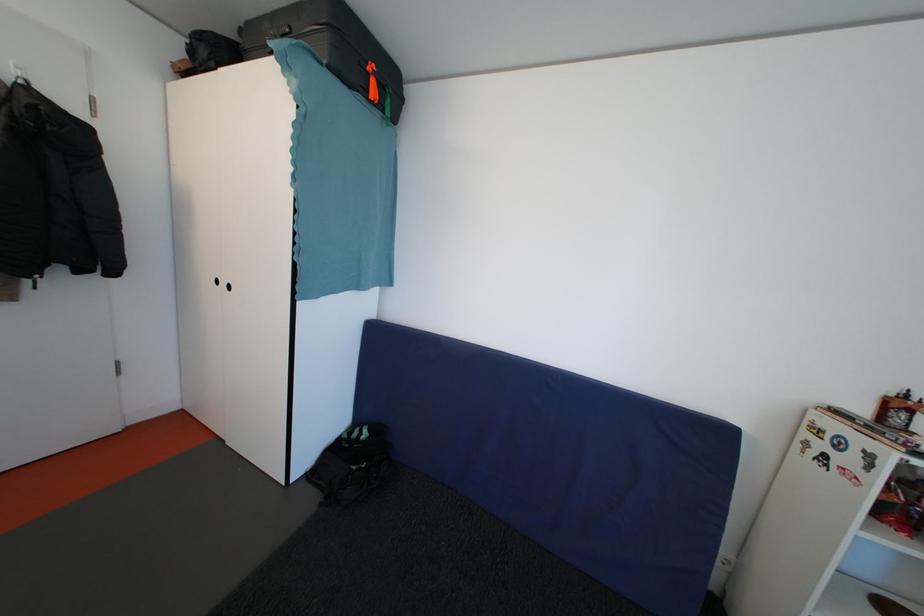
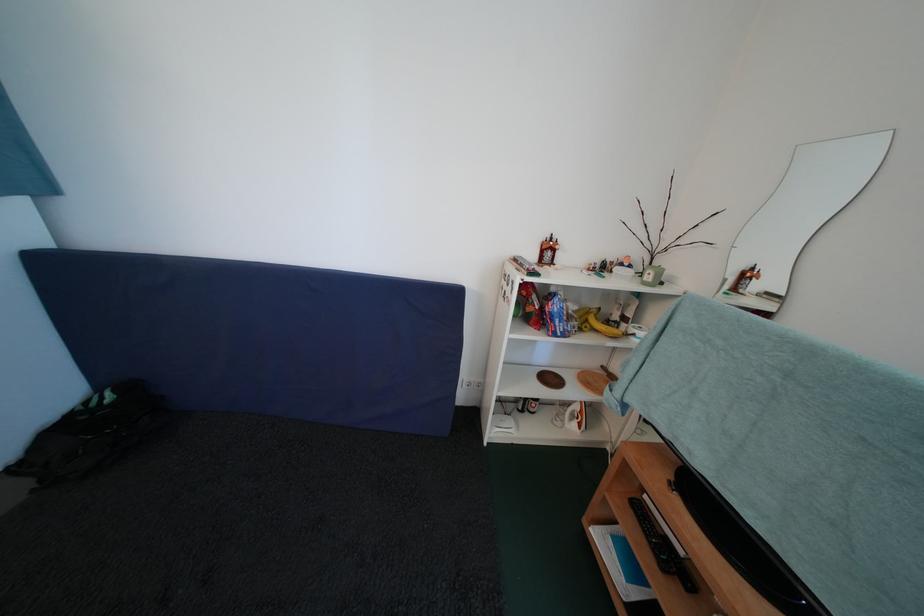
Locate, in the second image, the point that corresponds to [868,416] in the first image.

(539, 261)